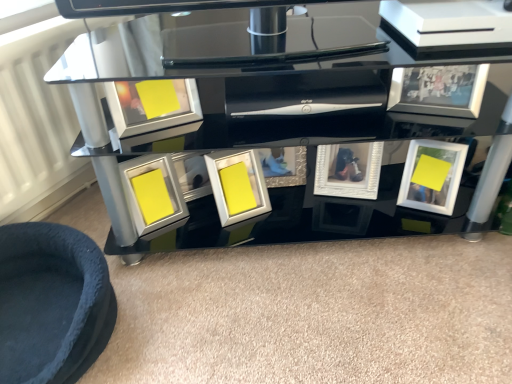
Locate an element on the screen. vacant space to the left of white glossy picture frame at lower right, the sixth picture frame in the left-to-right sequence is located at coordinates (376, 217).